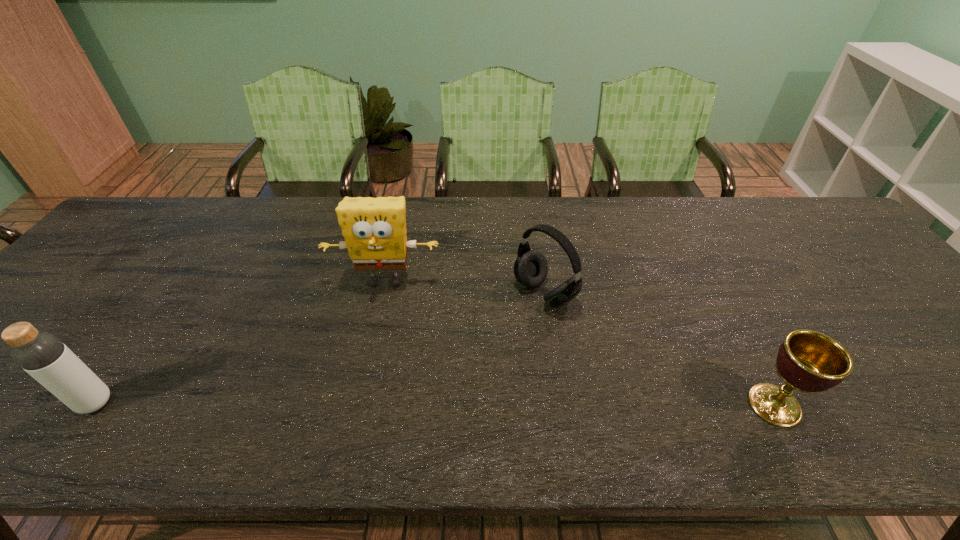
I want to click on vacant point that satisfies the following two spatial constraints: 1. on the front side of the third object from left to right; 2. on the left side of the rightmost object, so click(562, 405).

Where is `free space that satisfies the following two spatial constraints: 1. on the front side of the rightmost object; 2. on the left side of the sponge`? This screenshot has height=540, width=960. free space that satisfies the following two spatial constraints: 1. on the front side of the rightmost object; 2. on the left side of the sponge is located at coordinates (358, 405).